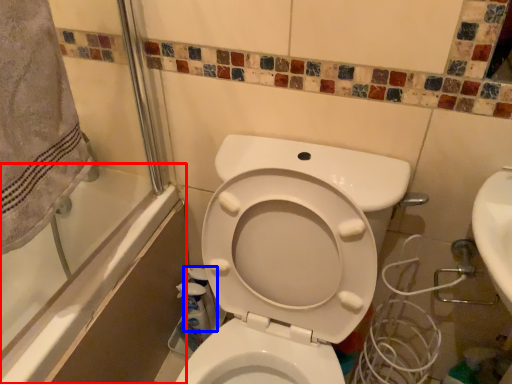
Question: Which object is further to the camera taking this photo, bath (highlighted by a red box) or cleaning product (highlighted by a blue box)?

Choices:
 (A) bath
 (B) cleaning product

Answer: (B)